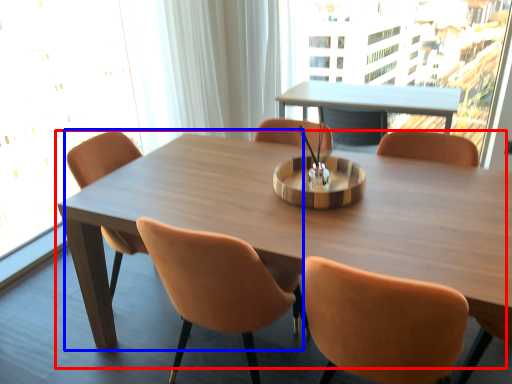
Question: Which of the following is the farthest to the observer, table (highlighted by a red box) or chair (highlighted by a blue box)?

Choices:
 (A) table
 (B) chair

Answer: (B)